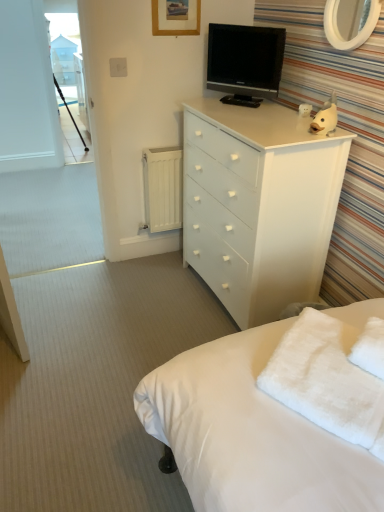
This screenshot has height=512, width=384. In order to click on free spot above white glossy chest of drawers at upper right (from a real-world perspective) in this screenshot , I will do `click(249, 112)`.